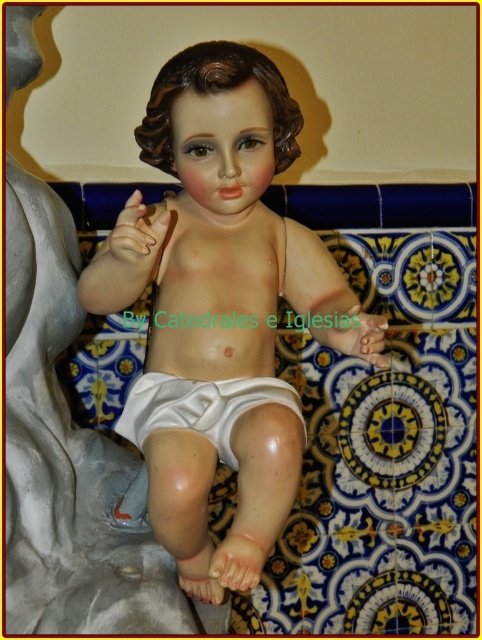
Can you confirm if white cloth diaper at center is wider than matte flesh-toned hand at center?

Yes, white cloth diaper at center is wider than matte flesh-toned hand at center.

Does white cloth diaper at center appear on the left side of matte flesh-toned hand at center?

No, white cloth diaper at center is not to the left of matte flesh-toned hand at center.

Find the location of a particular element. This screenshot has height=640, width=482. white cloth diaper at center is located at coordinates (199, 406).

Who is more forward, (151, 467) or (350, 346)?

Point (151, 467) is in front.

Can you confirm if smooth porcelain doll at center is positioned to the left of white matte hand at lower center?

Indeed, smooth porcelain doll at center is positioned on the left side of white matte hand at lower center.

What do you see at coordinates (221, 312) in the screenshot? I see `smooth porcelain doll at center` at bounding box center [221, 312].

Where is `smooth porcelain doll at center`? smooth porcelain doll at center is located at coordinates (221, 312).

Is smooth porcelain doll at center further to the viewer compared to matte flesh-toned hand at center?

Yes.

Is point (148, 403) positioned before point (141, 208)?

No, it is behind (141, 208).

Identify the location of smooth porcelain doll at center. This screenshot has height=640, width=482. (221, 312).

I want to click on smooth porcelain doll at center, so click(x=221, y=312).